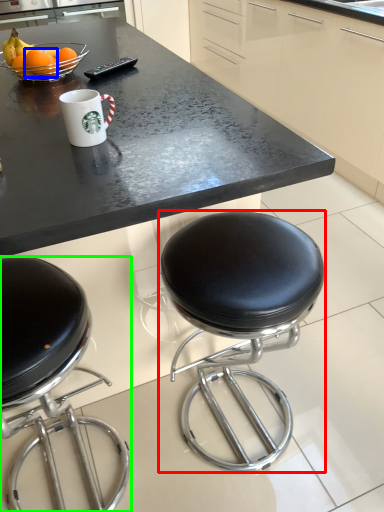
Question: Which object is the closest to the stool (highlighted by a red box)? Choose among these: orange (highlighted by a blue box) or chair (highlighted by a green box).

Choices:
 (A) orange
 (B) chair

Answer: (B)